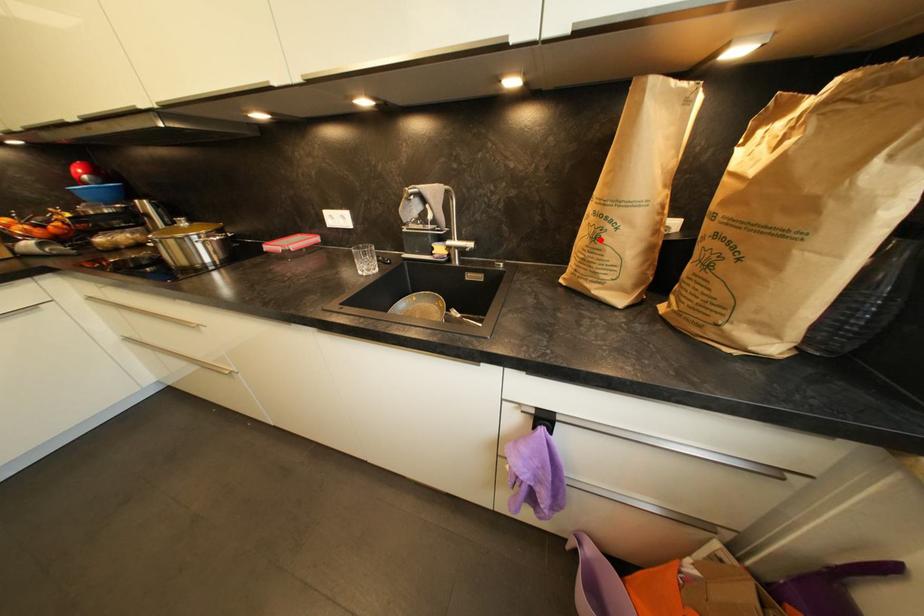
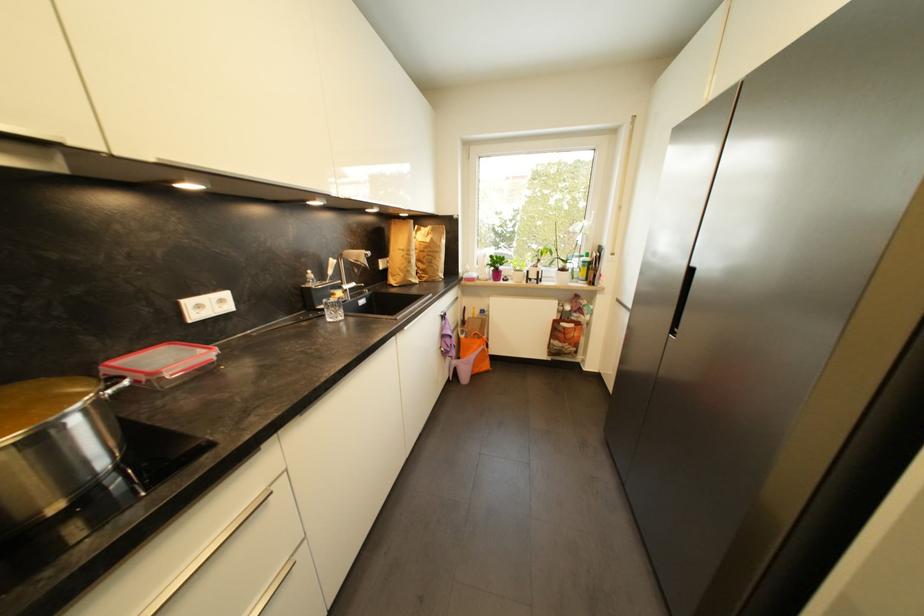
Where in the second image is the point corresponding to the highlighted location from the first image?

(415, 264)